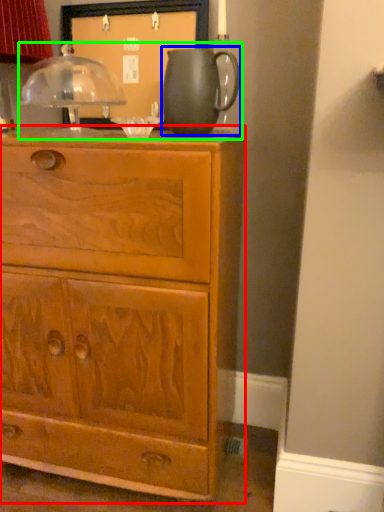
Question: Which object is positioned farthest from chest of drawers (highlighted by a red box)? Select from jug (highlighted by a blue box) and tea set (highlighted by a green box).

Choices:
 (A) jug
 (B) tea set

Answer: (B)